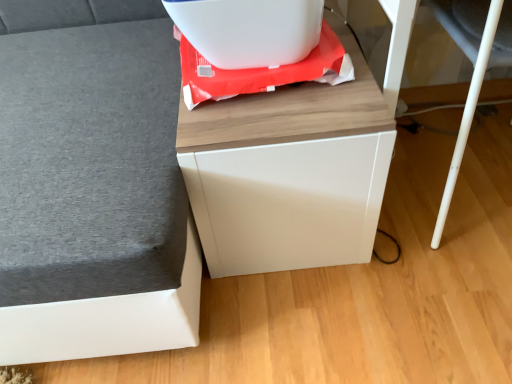
Question: Which direction should I rotate to face white glossy cabinet at center, arranged as the first furniture when viewed from the right, — up or down?

Choices:
 (A) down
 (B) up

Answer: (B)

Question: Is white plastic container at upper center completely or partially inside matte gray sofa at left, the second furniture positioned from the right?

Choices:
 (A) yes
 (B) no

Answer: (B)

Question: Considering the relative positions of matte gray sofa at left, the first furniture positioned from the left, and white plastic container at upper center in the image provided, is matte gray sofa at left, the first furniture positioned from the left, to the left of white plastic container at upper center from the viewer's perspective?

Choices:
 (A) yes
 (B) no

Answer: (A)

Question: Does matte gray sofa at left, the second furniture positioned from the right, have a smaller size compared to white plastic container at upper center?

Choices:
 (A) no
 (B) yes

Answer: (A)

Question: From a real-world perspective, does matte gray sofa at left, the second furniture positioned from the right, stand above white plastic container at upper center?

Choices:
 (A) yes
 (B) no

Answer: (B)

Question: Is matte gray sofa at left, the second furniture positioned from the right, outside of white plastic container at upper center?

Choices:
 (A) no
 (B) yes

Answer: (B)

Question: Considering the relative sizes of matte gray sofa at left, the second furniture positioned from the right, and white plastic container at upper center in the image provided, is matte gray sofa at left, the second furniture positioned from the right, thinner than white plastic container at upper center?

Choices:
 (A) no
 (B) yes

Answer: (A)

Question: Is matte gray sofa at left, the first furniture positioned from the left, facing towards white plastic swivel chair at lower right?

Choices:
 (A) yes
 (B) no

Answer: (B)

Question: From a real-world perspective, does matte gray sofa at left, the second furniture positioned from the right, sit lower than white plastic swivel chair at lower right?

Choices:
 (A) no
 (B) yes

Answer: (A)

Question: Does matte gray sofa at left, the first furniture positioned from the left, appear on the left side of white plastic swivel chair at lower right?

Choices:
 (A) no
 (B) yes

Answer: (B)

Question: Is the depth of matte gray sofa at left, the first furniture positioned from the left, greater than that of white plastic swivel chair at lower right?

Choices:
 (A) yes
 (B) no

Answer: (B)

Question: Does matte gray sofa at left, the first furniture positioned from the left, have a larger size compared to white plastic swivel chair at lower right?

Choices:
 (A) no
 (B) yes

Answer: (B)

Question: Does matte gray sofa at left, the second furniture positioned from the right, have a lesser height compared to white plastic swivel chair at lower right?

Choices:
 (A) yes
 (B) no

Answer: (B)

Question: From a real-world perspective, is white plastic container at upper center located higher than white glossy cabinet at center, which appears as the second furniture when viewed from the left?

Choices:
 (A) no
 (B) yes

Answer: (B)